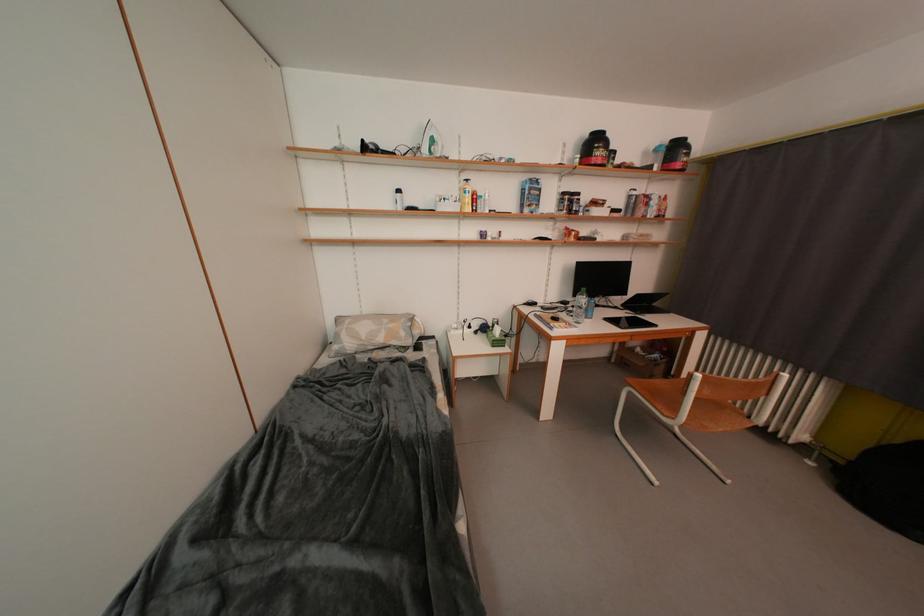
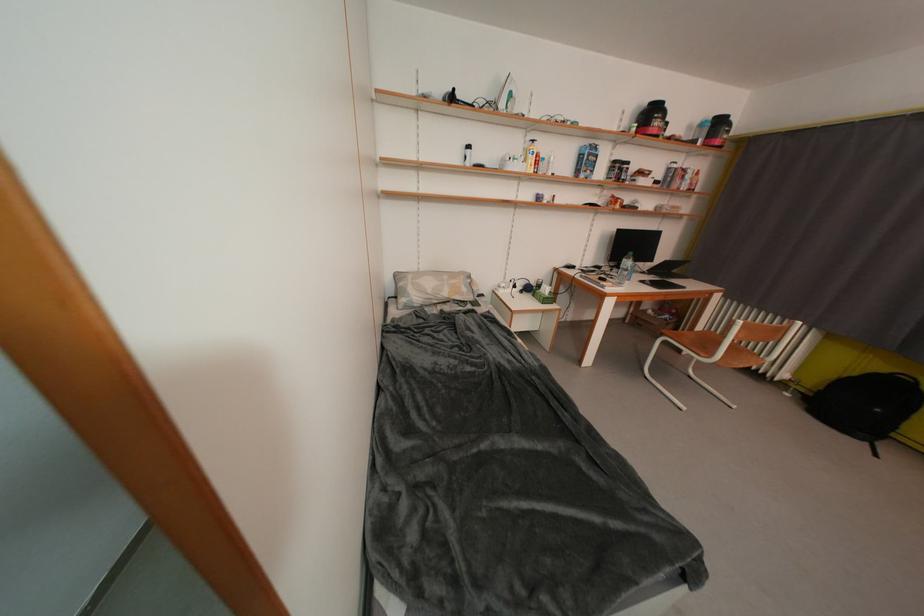
Find the pixel in the second image that matches pixel 371 151 in the first image.

(459, 100)